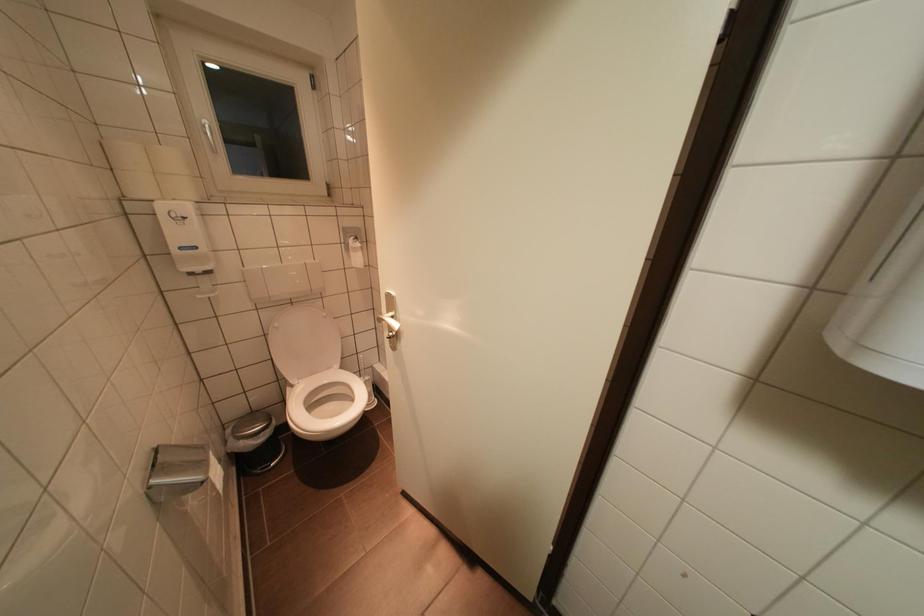
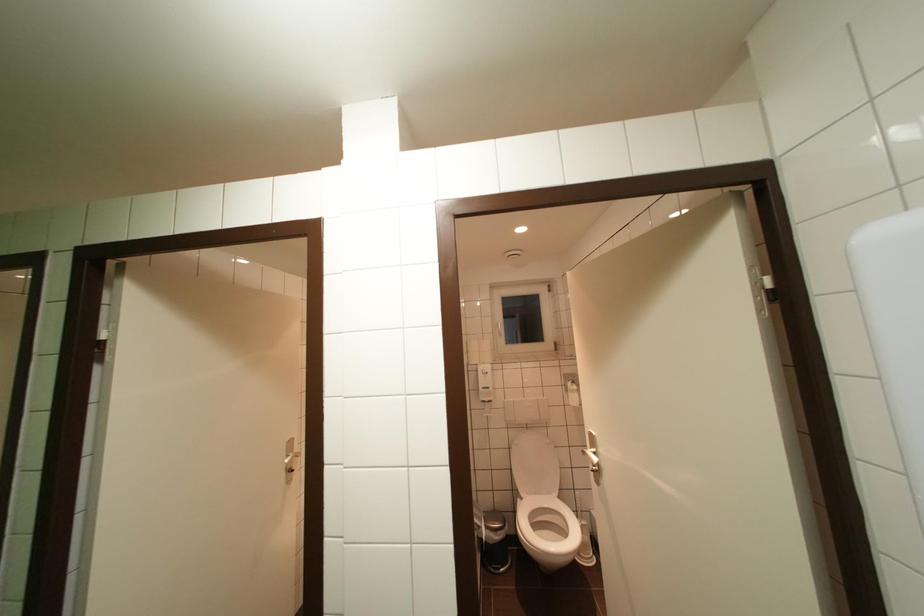
Locate, in the second image, the point that corresponds to pixel 261 427 in the first image.

(502, 523)